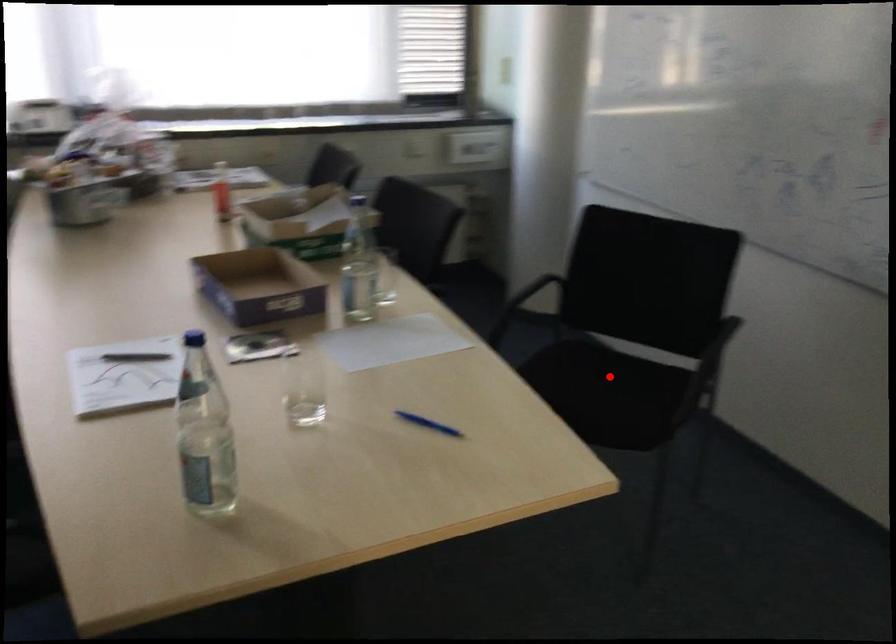
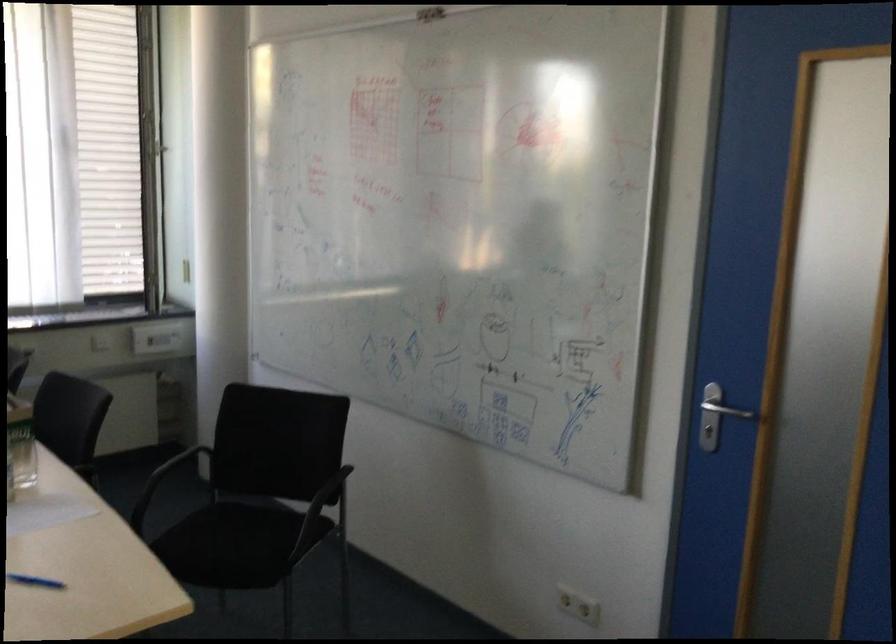
The point at the highlighted location is marked in the first image. Where is the corresponding point in the second image?

(251, 529)